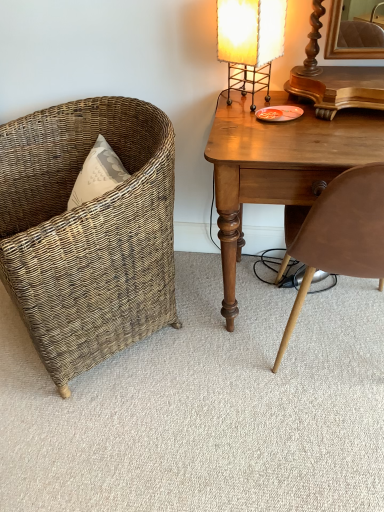
What do you see at coordinates (250, 42) in the screenshot? The image size is (384, 512). I see `matte yellow fabric lampshade at upper right` at bounding box center [250, 42].

Find the location of a particular element. The height and width of the screenshot is (512, 384). woven brown chair at left, which is counted as the first chair, starting from the left is located at coordinates (88, 231).

Which object is closer to the camera taking this photo, matte yellow fabric lampshade at upper right or brown leather chair at right, the first chair when ordered from right to left?

brown leather chair at right, the first chair when ordered from right to left, is more forward.

Can you tell me how much matte yellow fabric lampshade at upper right and brown leather chair at right, the first chair when ordered from right to left, differ in facing direction?

They differ by 120 degrees in their facing directions.

Is matte yellow fabric lampshade at upper right facing towards brown leather chair at right, the 2th chair in the left-to-right sequence?

No, matte yellow fabric lampshade at upper right is not turned towards brown leather chair at right, the 2th chair in the left-to-right sequence.

Relative to matte yellow fabric lampshade at upper right, is woven brown chair at left, which is counted as the first chair, starting from the left, in front or behind?

In the image, woven brown chair at left, which is counted as the first chair, starting from the left, appears in front of matte yellow fabric lampshade at upper right.

Which of these two, woven brown chair at left, which is counted as the first chair, starting from the left, or matte yellow fabric lampshade at upper right, is bigger?

Bigger between the two is woven brown chair at left, which is counted as the first chair, starting from the left.

Considering the sizes of woven brown chair at left, which is counted as the first chair, starting from the left, and matte yellow fabric lampshade at upper right in the image, is woven brown chair at left, which is counted as the first chair, starting from the left, wider or thinner than matte yellow fabric lampshade at upper right?

In the image, woven brown chair at left, which is counted as the first chair, starting from the left, appears to be wider than matte yellow fabric lampshade at upper right.

Between point (49, 165) and point (266, 70), which one is positioned behind?

The point (49, 165) is behind.

From a real-world perspective, between brown leather chair at right, the first chair when ordered from right to left, and woven wicker chair at left, who is vertically higher?

brown leather chair at right, the first chair when ordered from right to left, is physically above.

Is brown leather chair at right, the 2th chair in the left-to-right sequence, taller than woven wicker chair at left?

Indeed, brown leather chair at right, the 2th chair in the left-to-right sequence, has a greater height compared to woven wicker chair at left.

Are brown leather chair at right, the 2th chair in the left-to-right sequence, and woven wicker chair at left far apart?

No, brown leather chair at right, the 2th chair in the left-to-right sequence, is in close proximity to woven wicker chair at left.

How different are the orientations of woven brown chair at left, which is counted as the first chair, starting from the left, and woven wicker chair at left in degrees?

The angle between the facing direction of woven brown chair at left, which is counted as the first chair, starting from the left, and the facing direction of woven wicker chair at left is 42.5 degrees.

Relative to woven wicker chair at left, is woven brown chair at left, which is the 2th chair from right to left, in front or behind?

In the image, woven brown chair at left, which is the 2th chair from right to left, appears in front of woven wicker chair at left.

Between woven brown chair at left, which is counted as the first chair, starting from the left, and woven wicker chair at left, which one has smaller size?

woven wicker chair at left is smaller.

Which point is more distant from viewer, (157,290) or (339,392)?

Positioned behind is point (157,290).

How distant is wooden desk at right from brown leather chair at right, the 2th chair in the left-to-right sequence?

wooden desk at right is 8.84 inches away from brown leather chair at right, the 2th chair in the left-to-right sequence.

Is wooden desk at right wider than brown leather chair at right, the 2th chair in the left-to-right sequence?

Incorrect, the width of wooden desk at right does not surpass that of brown leather chair at right, the 2th chair in the left-to-right sequence.

This screenshot has height=512, width=384. What are the coordinates of `desk below the brown leather chair at right, the 2th chair in the left-to-right sequence (from a real-world perspective)` in the screenshot? It's located at (280, 169).

Looking at this image, what's the angular difference between wooden desk at right and brown leather chair at right, the first chair when ordered from right to left,'s facing directions?

The facing directions of wooden desk at right and brown leather chair at right, the first chair when ordered from right to left, are 180 degrees apart.

Considering the positions of objects wooden desk at right and woven brown chair at left, which is the 2th chair from right to left, in the image provided, who is more to the right, wooden desk at right or woven brown chair at left, which is the 2th chair from right to left,?

wooden desk at right.

From a real-world perspective, is wooden desk at right positioned above or below woven brown chair at left, which is counted as the first chair, starting from the left?

wooden desk at right is below woven brown chair at left, which is counted as the first chair, starting from the left.

How far apart are wooden desk at right and woven brown chair at left, which is counted as the first chair, starting from the left?

A distance of 15.17 inches exists between wooden desk at right and woven brown chair at left, which is counted as the first chair, starting from the left.

Considering the relative sizes of wooden desk at right and woven brown chair at left, which is the 2th chair from right to left, in the image provided, is wooden desk at right shorter than woven brown chair at left, which is the 2th chair from right to left,?

Yes, wooden desk at right is shorter than woven brown chair at left, which is the 2th chair from right to left.

Is brown leather chair at right, the 2th chair in the left-to-right sequence, far from woven brown chair at left, which is counted as the first chair, starting from the left?

brown leather chair at right, the 2th chair in the left-to-right sequence, is near woven brown chair at left, which is counted as the first chair, starting from the left, not far away.

Considering the relative sizes of brown leather chair at right, the 2th chair in the left-to-right sequence, and woven brown chair at left, which is counted as the first chair, starting from the left, in the image provided, is brown leather chair at right, the 2th chair in the left-to-right sequence, taller than woven brown chair at left, which is counted as the first chair, starting from the left,?

Yes.

Which is more to the right, brown leather chair at right, the first chair when ordered from right to left, or woven brown chair at left, which is the 2th chair from right to left?

brown leather chair at right, the first chair when ordered from right to left, is more to the right.

Can you confirm if brown leather chair at right, the 2th chair in the left-to-right sequence, is wider than woven brown chair at left, which is the 2th chair from right to left?

In fact, brown leather chair at right, the 2th chair in the left-to-right sequence, might be narrower than woven brown chair at left, which is the 2th chair from right to left.

Find the location of a particular element. The width and height of the screenshot is (384, 512). lamp above the brown leather chair at right, the first chair when ordered from right to left (from the image's perspective) is located at coordinates (250, 42).

You are a GUI agent. You are given a task and a screenshot of the screen. Output one action in this format:
    pyautogui.click(x=<x>, y=<y>)
    Task: Click on the chair that is the 1st one when counting forward from the matte yellow fabric lampshade at upper right
    
    Given the screenshot: What is the action you would take?
    pyautogui.click(x=88, y=231)

Estimate the real-world distances between objects in this image. Which object is further from brown leather chair at right, the first chair when ordered from right to left, wooden desk at right or woven brown chair at left, which is the 2th chair from right to left?

Based on the image, woven brown chair at left, which is the 2th chair from right to left, appears to be further to brown leather chair at right, the first chair when ordered from right to left.

When comparing their distances from woven wicker chair at left, does woven brown chair at left, which is counted as the first chair, starting from the left, or matte yellow fabric lampshade at upper right seem further?

matte yellow fabric lampshade at upper right is further to woven wicker chair at left.

Which object lies nearer to the anchor point matte yellow fabric lampshade at upper right, woven brown chair at left, which is the 2th chair from right to left, or brown leather chair at right, the first chair when ordered from right to left?

brown leather chair at right, the first chair when ordered from right to left.

Looking at this image, looking at the image, which one is located further to matte yellow fabric lampshade at upper right, woven brown chair at left, which is the 2th chair from right to left, or wooden desk at right?

Among the two, woven brown chair at left, which is the 2th chair from right to left, is located further to matte yellow fabric lampshade at upper right.

When comparing their distances from woven wicker chair at left, does brown leather chair at right, the 2th chair in the left-to-right sequence, or wooden desk at right seem closer?

wooden desk at right is positioned closer to the anchor woven wicker chair at left.

Based on the photo, which object lies further to the anchor point woven brown chair at left, which is counted as the first chair, starting from the left, matte yellow fabric lampshade at upper right or brown leather chair at right, the first chair when ordered from right to left?

Based on the image, brown leather chair at right, the first chair when ordered from right to left, appears to be further to woven brown chair at left, which is counted as the first chair, starting from the left.

When comparing their distances from woven brown chair at left, which is counted as the first chair, starting from the left, does brown leather chair at right, the first chair when ordered from right to left, or matte yellow fabric lampshade at upper right seem closer?

matte yellow fabric lampshade at upper right is positioned closer to the anchor woven brown chair at left, which is counted as the first chair, starting from the left.

When comparing their distances from woven brown chair at left, which is counted as the first chair, starting from the left, does woven wicker chair at left or matte yellow fabric lampshade at upper right seem further?

matte yellow fabric lampshade at upper right lies further to woven brown chair at left, which is counted as the first chair, starting from the left, than the other object.

Find the location of a particular element. This screenshot has width=384, height=512. desk between matte yellow fabric lampshade at upper right and woven wicker chair at left from top to bottom is located at coordinates (280, 169).

I want to click on desk situated between woven wicker chair at left and brown leather chair at right, the first chair when ordered from right to left, from left to right, so pos(280,169).

Where is `plain situated between woven brown chair at left, which is counted as the first chair, starting from the left, and brown leather chair at right, the first chair when ordered from right to left, from left to right`? Image resolution: width=384 pixels, height=512 pixels. plain situated between woven brown chair at left, which is counted as the first chair, starting from the left, and brown leather chair at right, the first chair when ordered from right to left, from left to right is located at coordinates pyautogui.click(x=206, y=407).

I want to click on plain between woven brown chair at left, which is counted as the first chair, starting from the left, and wooden desk at right from left to right, so click(206, 407).